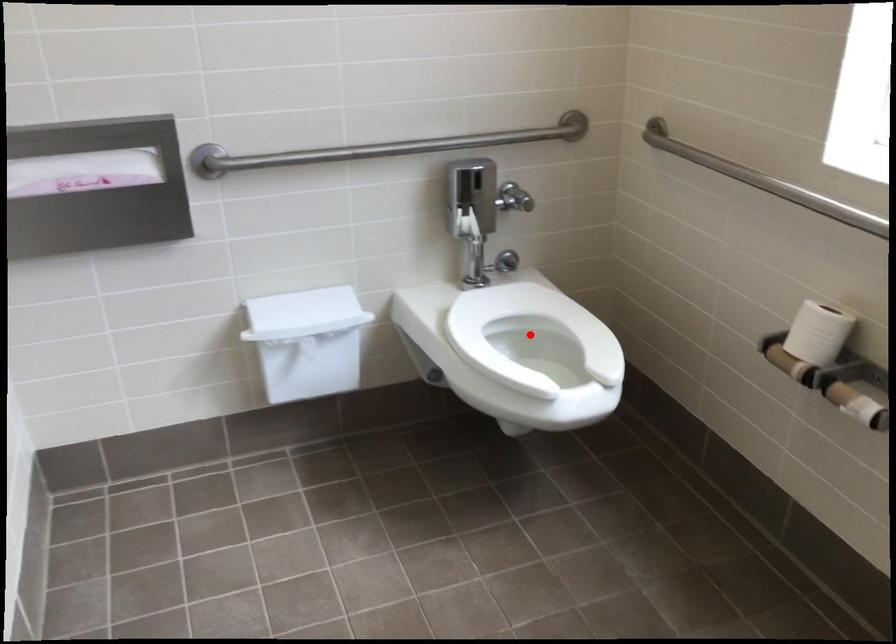
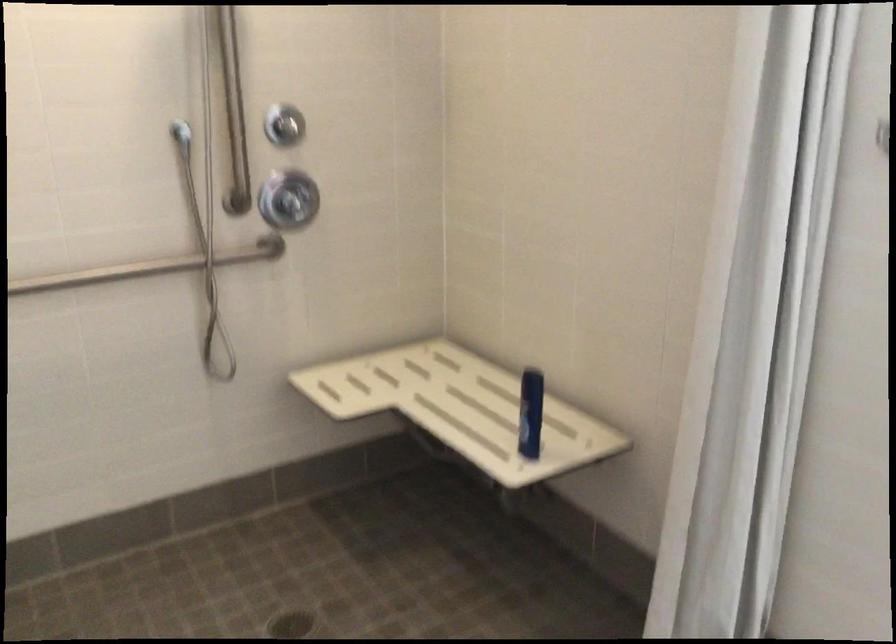
Question: I am providing you with two images of the same scene from different viewpoints. A red point is marked on the first image. At the location where the point appears in image 1, is it still visible in image 2?

Choices:
 (A) Yes
 (B) No

Answer: (B)